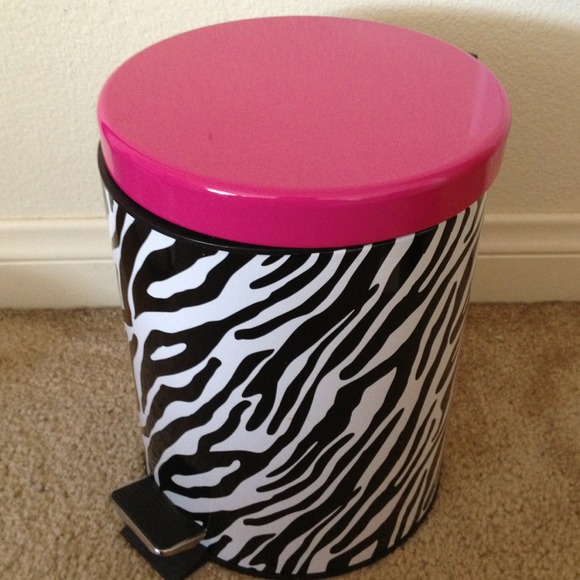
Where is `rim of trashcan`? rim of trashcan is located at coordinates (184, 237).